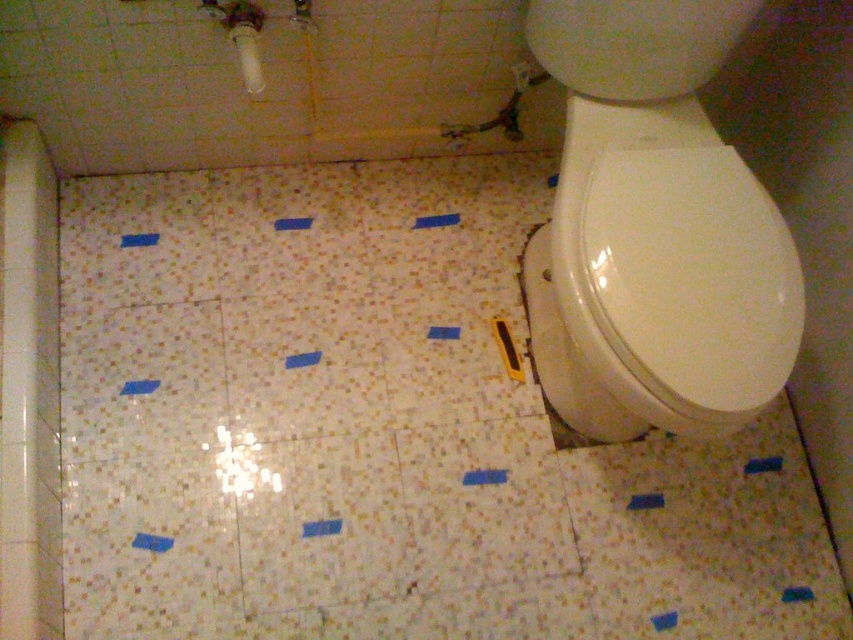
You are a contractor measuring the bathroom floor. You need to place a new fixture at the center of the porcelain mosaic tile at center. What are the coordinates where you should place it?

The porcelain mosaic tile at center is located at point (381, 429), so you should place the new fixture at those coordinates.

You are standing in the bathroom and want to determine the distance between the two points marked in the scene. Which point is closer to you, point (770, 236) or point (250, 42)?

Point (770, 236) is closer to the viewer than point (250, 42).